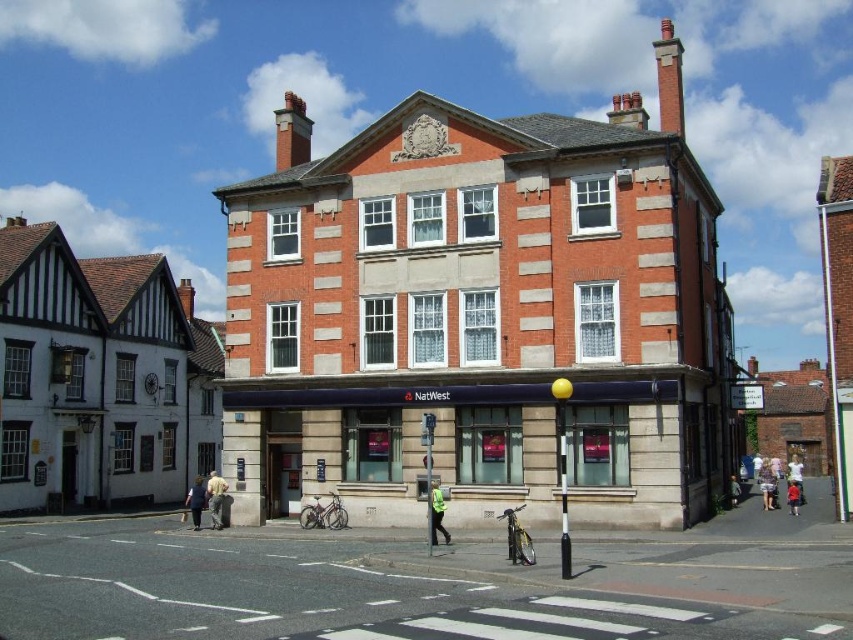
Does light blue denim jacket at center have a lesser width compared to dark blue jeans at lower right?

Incorrect, light blue denim jacket at center's width is not less than dark blue jeans at lower right's.

Is point (795, 472) less distant than point (788, 497)?

That is False.

Does point (793, 481) lie behind point (788, 509)?

Yes, it is.

The image size is (853, 640). In order to click on light blue denim jacket at center in this screenshot , I will do `click(795, 474)`.

Looking at this image, does dark blue fabric jacket at lower left have a smaller size compared to light blue denim jacket at center?

Indeed, dark blue fabric jacket at lower left has a smaller size compared to light blue denim jacket at center.

Is point (196, 493) closer to viewer compared to point (788, 477)?

Yes, point (196, 493) is in front of point (788, 477).

Locate an element on the screen. Image resolution: width=853 pixels, height=640 pixels. dark blue fabric jacket at lower left is located at coordinates (196, 500).

Which is below, high visibility yellow jacket at center or dark blue fabric jacket at lower left?

Positioned lower is dark blue fabric jacket at lower left.

Between high visibility yellow jacket at center and dark blue fabric jacket at lower left, which one appears on the left side from the viewer's perspective?

dark blue fabric jacket at lower left is more to the left.

Is point (432, 515) positioned after point (192, 508)?

No, (432, 515) is in front of (192, 508).

Where is `high visibility yellow jacket at center`? The width and height of the screenshot is (853, 640). high visibility yellow jacket at center is located at coordinates (437, 513).